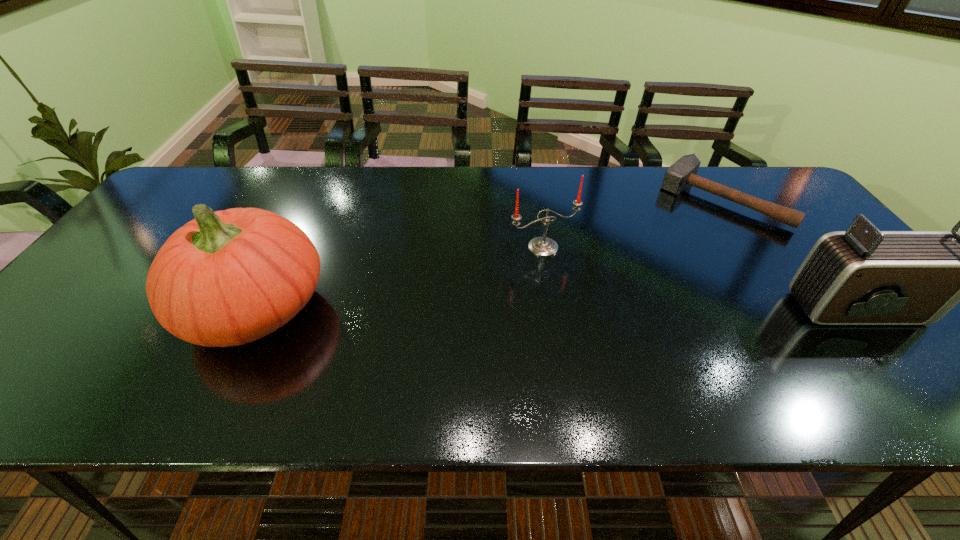
Where is `free space on the desktop that is between the leftmost object and the camcorder and is positioned on the striking surface of the shortest object`? The image size is (960, 540). free space on the desktop that is between the leftmost object and the camcorder and is positioned on the striking surface of the shortest object is located at coordinates (617, 308).

Find the location of a particular element. free space on the desktop that is between the pumpkin and the camcorder and is positioned on the front-facing side of the second farthest object is located at coordinates (590, 308).